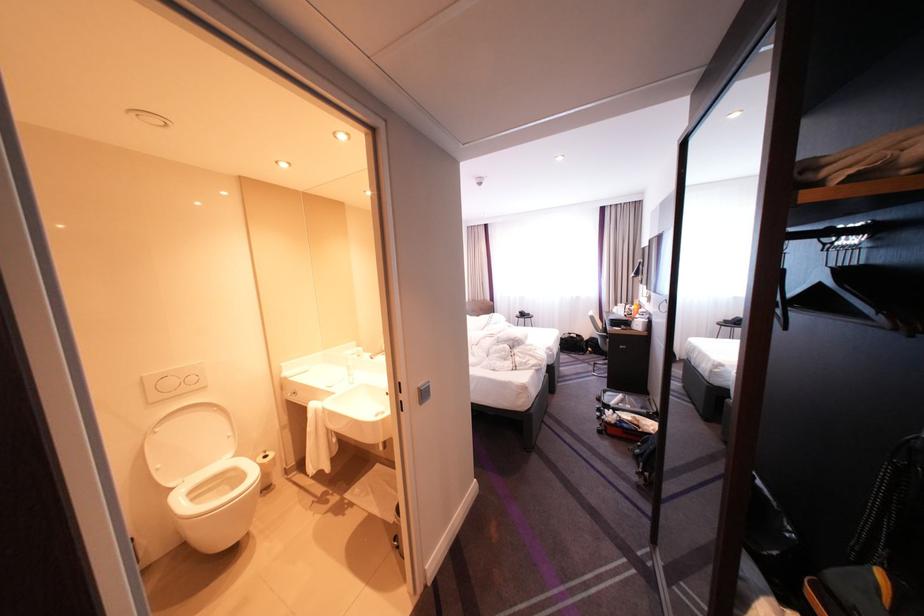
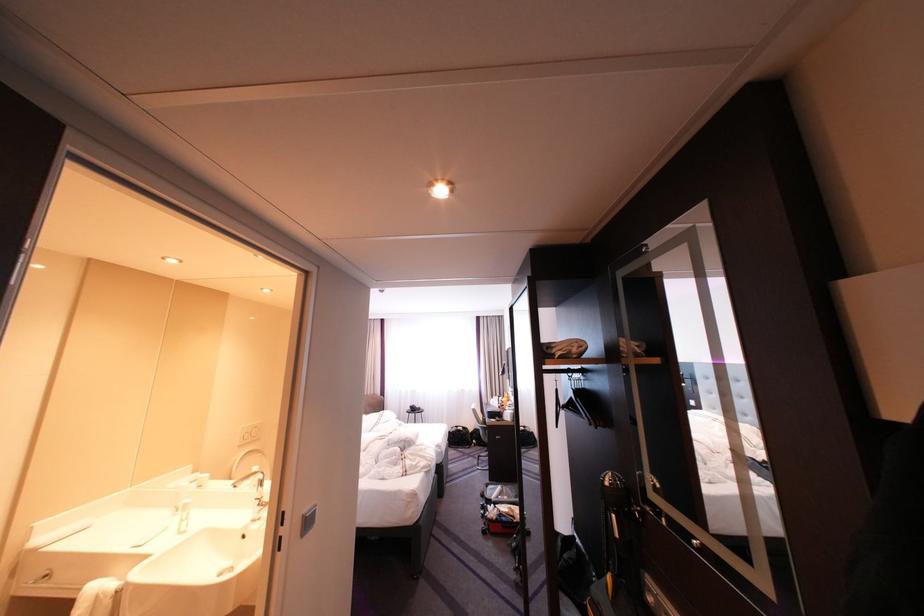
Locate, in the second image, the point that corresponds to (x=622, y=407) in the first image.

(503, 501)